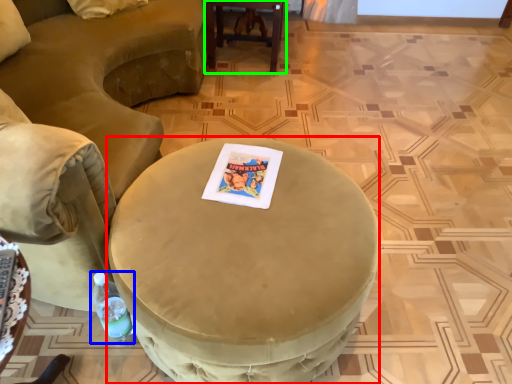
Question: Which is farther away from coffee table (highlighted by a red box)? bottle (highlighted by a blue box) or table (highlighted by a green box)?

Choices:
 (A) bottle
 (B) table

Answer: (B)